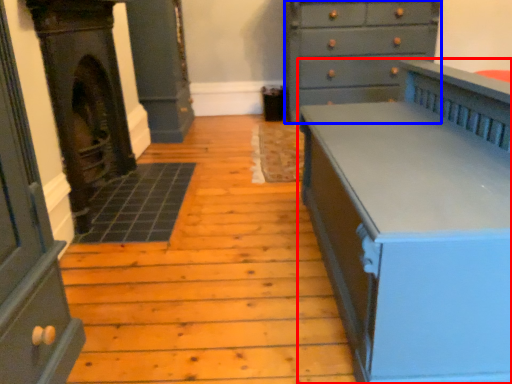
Question: Among these objects, which one is nearest to the camera, chest of drawers (highlighted by a red box) or chest of drawers (highlighted by a blue box)?

Choices:
 (A) chest of drawers
 (B) chest of drawers

Answer: (A)